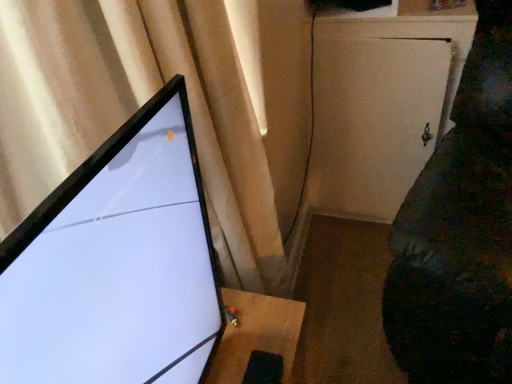
Question: Relative to white matte cabinet at right, is velvet dark green couch at right in front or behind?

Choices:
 (A) front
 (B) behind

Answer: (A)

Question: Is velvet dark green couch at right wider or thinner than white matte cabinet at right?

Choices:
 (A) thin
 (B) wide

Answer: (B)

Question: Based on their relative distances, which object is farther from the matte black monitor at left?

Choices:
 (A) velvet dark green couch at right
 (B) white matte cabinet at right
 (C) matte beige curtain at upper left

Answer: (B)

Question: Estimate the real-world distances between objects in this image. Which object is closer to the white matte cabinet at right?

Choices:
 (A) velvet dark green couch at right
 (B) matte beige curtain at upper left
 (C) matte black monitor at left

Answer: (A)